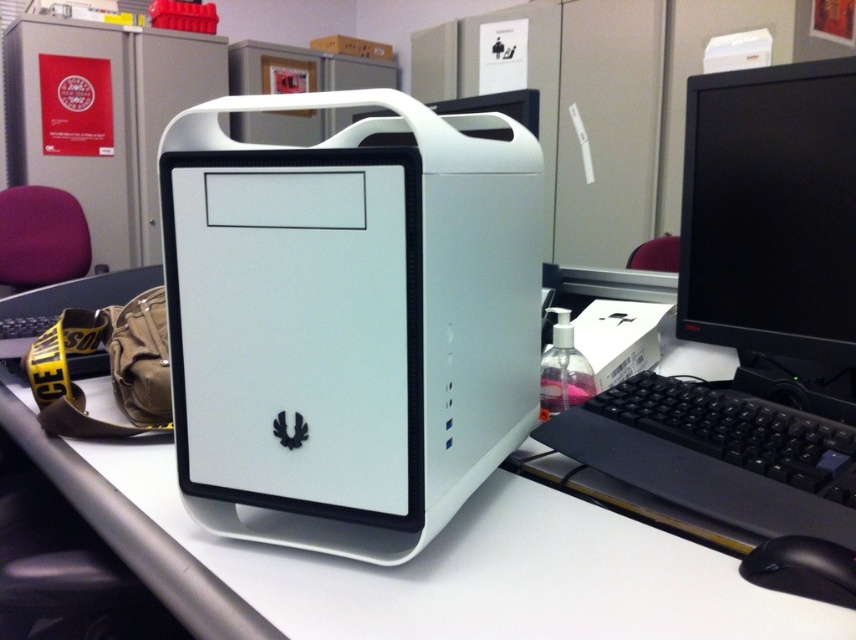
You are organizing your office and want to place the white plastic computer at center on top of the white plastic computer desk at center. Based on their sizes, will the computer fit entirely on the desk without overhanging?

The white plastic computer at center is smaller than the white plastic computer desk at center, so it will fit entirely on the desk without overhanging.

You are setting up a new computer and want to place the white plastic computer at center on the white plastic computer desk at center. Will the computer fit on the desk without overhanging the edges?

The white plastic computer at center has a lesser width compared to the white plastic computer desk at center, so it will fit without overhanging the edges.